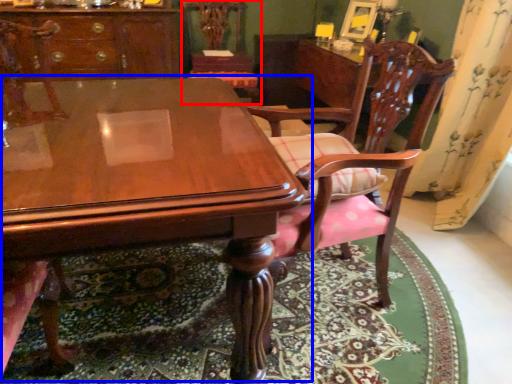
Question: Which of the following is the closest to the observer, chair (highlighted by a red box) or table (highlighted by a blue box)?

Choices:
 (A) chair
 (B) table

Answer: (B)